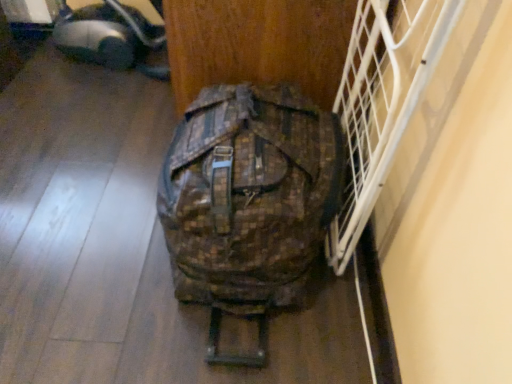
You are a GUI agent. You are given a task and a screenshot of the screen. Output one action in this format:
    pyautogui.click(x=<x>, y=<y>)
    Task: Click on the camouflage fabric backpack at center
    
    Given the screenshot: What is the action you would take?
    pyautogui.click(x=248, y=202)

Measure the distance between camouflage fabric backpack at center and camera.

camouflage fabric backpack at center is 35.40 inches from camera.

This screenshot has width=512, height=384. What do you see at coordinates (248, 202) in the screenshot?
I see `camouflage fabric backpack at center` at bounding box center [248, 202].

Identify the location of camouflage fabric backpack at center. (248, 202).